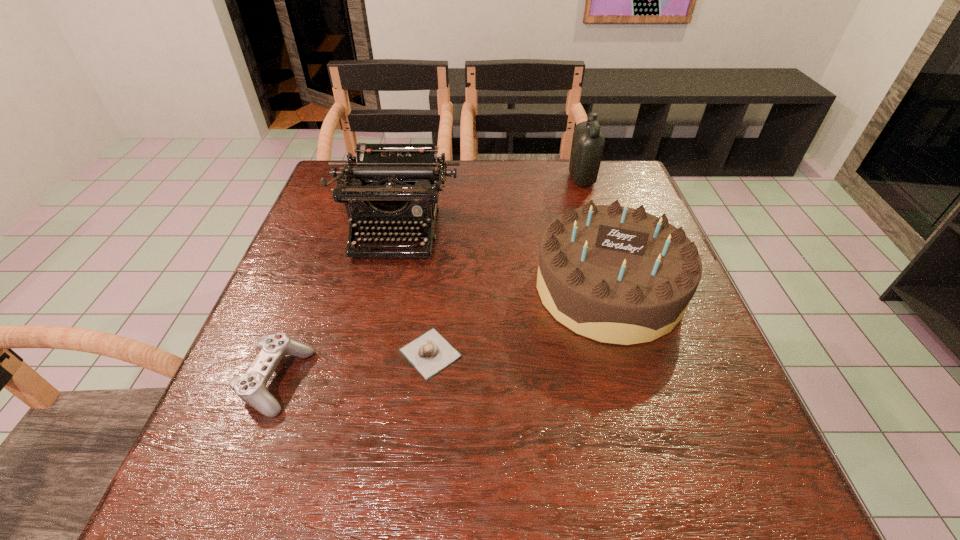
You are a GUI agent. You are given a task and a screenshot of the screen. Output one action in this format:
    pyautogui.click(x=<x>, y=<y>)
    Task: Click on the unoccupied area between the bottle and the shortest object
    The width and height of the screenshot is (960, 540).
    Given the screenshot: What is the action you would take?
    pyautogui.click(x=506, y=266)

I want to click on object identified as the closest to the farthest object, so click(614, 274).

Where is `object identified as the fourth closest to the shortest object`? This screenshot has height=540, width=960. object identified as the fourth closest to the shortest object is located at coordinates (588, 142).